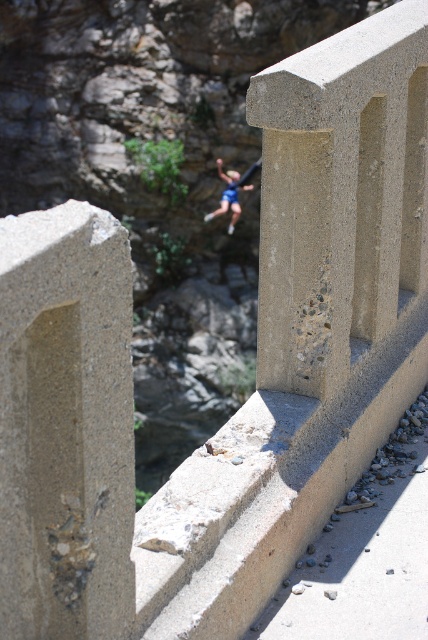
You are standing on the bridge and want to place a small potted plant between the gray textured concrete at left and the beige concrete pillar at center. Given their sizes, which object should the plant be closer to?

The gray textured concrete at left occupies less space than the beige concrete pillar at center, so the plant should be placed closer to the beige concrete pillar at center to ensure there is enough room.

You are a photographer standing on the bridge and want to capture both the beige concrete pillar at center and the blue fabric rock climber at center in a single frame. Which object should you focus on first to ensure both are in the frame?

You should focus on the beige concrete pillar at center first because it is larger than the blue fabric rock climber at center, making it easier to frame both objects together.

You are standing on the bridge and want to place a small marker at point [65,426]. What material will the marker be placed on?

The marker will be placed on gray textured concrete at left at point [65,426].